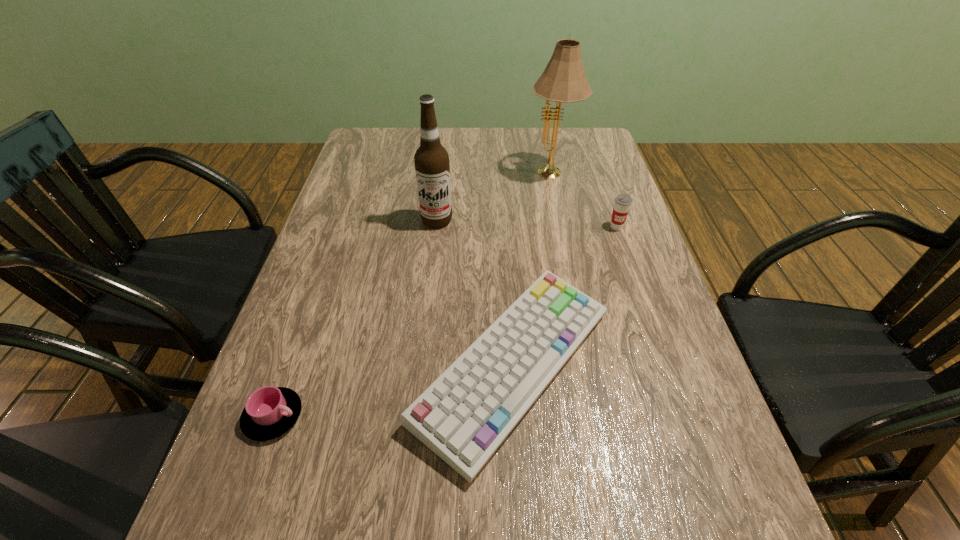
Image resolution: width=960 pixels, height=540 pixels. In the image, there is a desktop. Find the location of `vacant space at the left edge`. vacant space at the left edge is located at coordinates (321, 279).

Where is `free region at the right edge of the desktop`? This screenshot has height=540, width=960. free region at the right edge of the desktop is located at coordinates (636, 392).

Identify the location of free space at the far left corner. This screenshot has width=960, height=540. (367, 163).

I want to click on vacant space at the far right corner of the desktop, so click(x=587, y=131).

This screenshot has width=960, height=540. I want to click on vacant space that's between the shorter cup and the taller cup, so click(444, 322).

You are a GUI agent. You are given a task and a screenshot of the screen. Output one action in this format:
    pyautogui.click(x=<x>, y=<y>)
    Task: Click on the vacant point located between the computer keyboard and the shortest object
    The image size is (960, 540).
    Given the screenshot: What is the action you would take?
    pyautogui.click(x=394, y=391)

Locate an element on the screen. This screenshot has width=960, height=540. vacant area that lies between the rightmost object and the tallest object is located at coordinates pos(584,201).

At what (x,y) coordinates should I click in order to perform the action: click on vacant area that lies between the fourth shortest object and the right cup. Please return your answer as a coordinate pair (x, y). This screenshot has height=540, width=960. Looking at the image, I should click on (527, 224).

I want to click on vacant space that's between the second tallest object and the shorter cup, so click(355, 319).

Where is `free point between the tallest object and the third tallest object`? Image resolution: width=960 pixels, height=540 pixels. free point between the tallest object and the third tallest object is located at coordinates (584, 201).